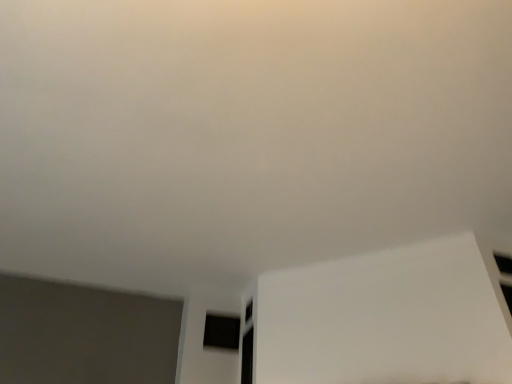
The height and width of the screenshot is (384, 512). What do you see at coordinates (221, 331) in the screenshot?
I see `black matte window at center` at bounding box center [221, 331].

What is the approximate width of black matte window at center?

5.82 inches.

Identify the location of black matte window at center. This screenshot has height=384, width=512. (221, 331).

Measure the distance between black matte window at center and camera.

black matte window at center is 7.33 feet away from camera.

This screenshot has height=384, width=512. Identify the location of black matte window at center. (221, 331).